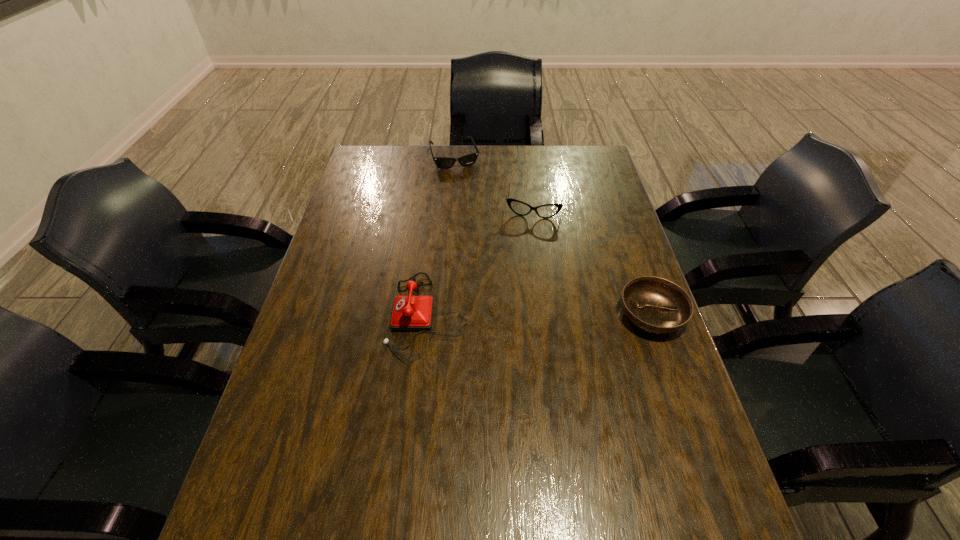
Identify the location of free space on the desktop that is between the telephone and the soup bowl and is positioned on the front-facing side of the spectacles. (516, 315).

Where is `vacant space on the desktop that is between the tallest object and the soup bowl and is positioned on the front-facing side of the sunglasses`? The image size is (960, 540). vacant space on the desktop that is between the tallest object and the soup bowl and is positioned on the front-facing side of the sunglasses is located at coordinates (513, 315).